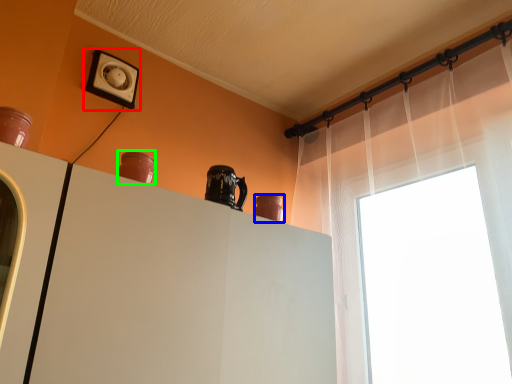
Question: Which object is positioned closest to electric outlet (highlighted by a red box)? Select from vase (highlighted by a blue box) and vase (highlighted by a green box).

Choices:
 (A) vase
 (B) vase

Answer: (B)